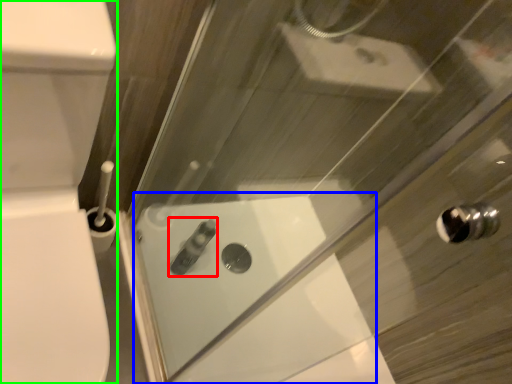
Question: Which object is the farthest from toiletry (highlighted by a red box)? Choose among these: bath (highlighted by a blue box) or porcelain (highlighted by a green box).

Choices:
 (A) bath
 (B) porcelain

Answer: (B)